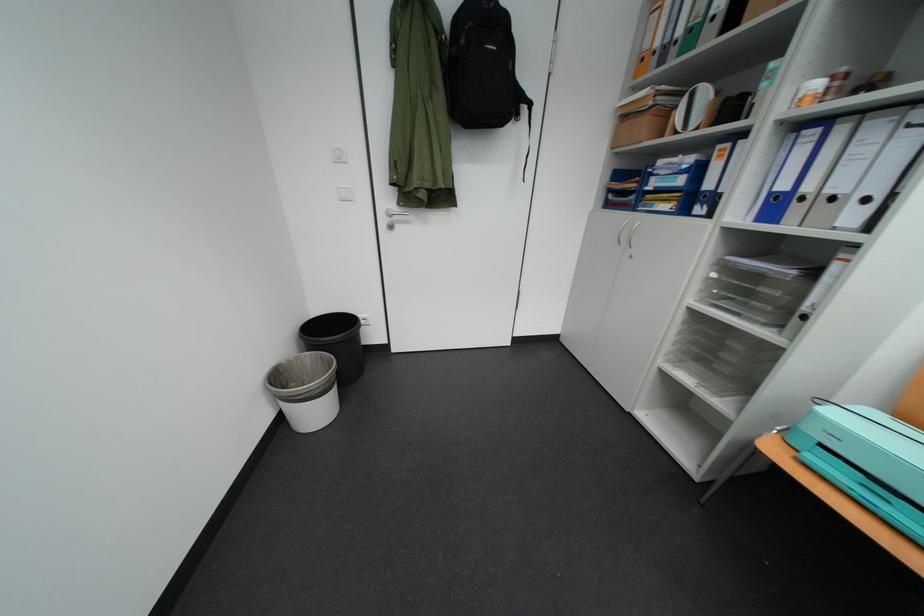
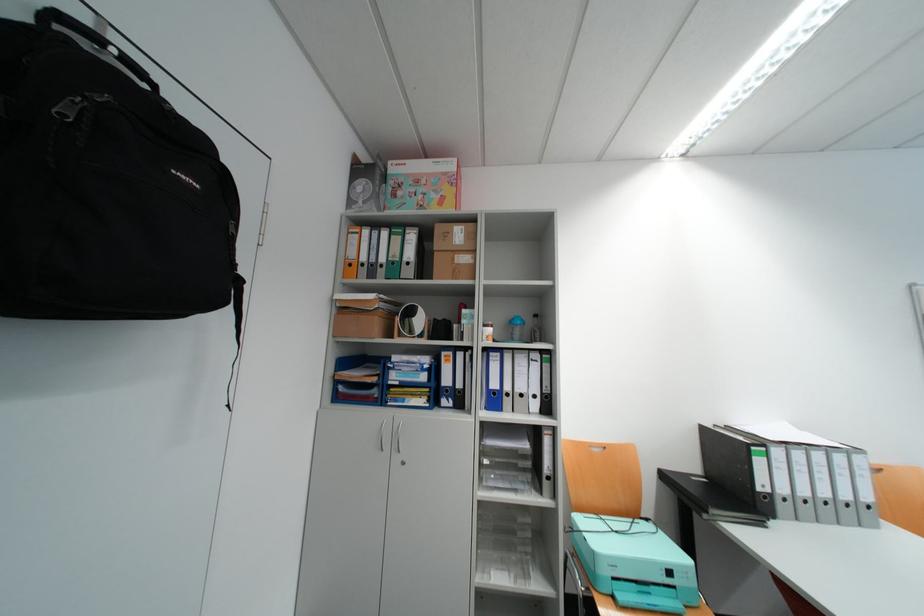
Locate, in the second image, the point that corresponds to [669,192] in the first image.

(415, 387)